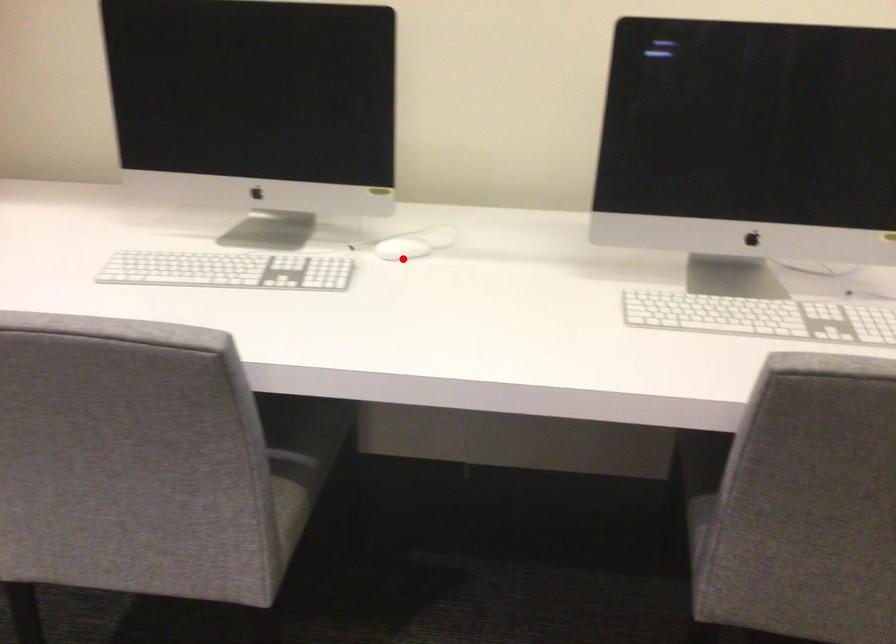
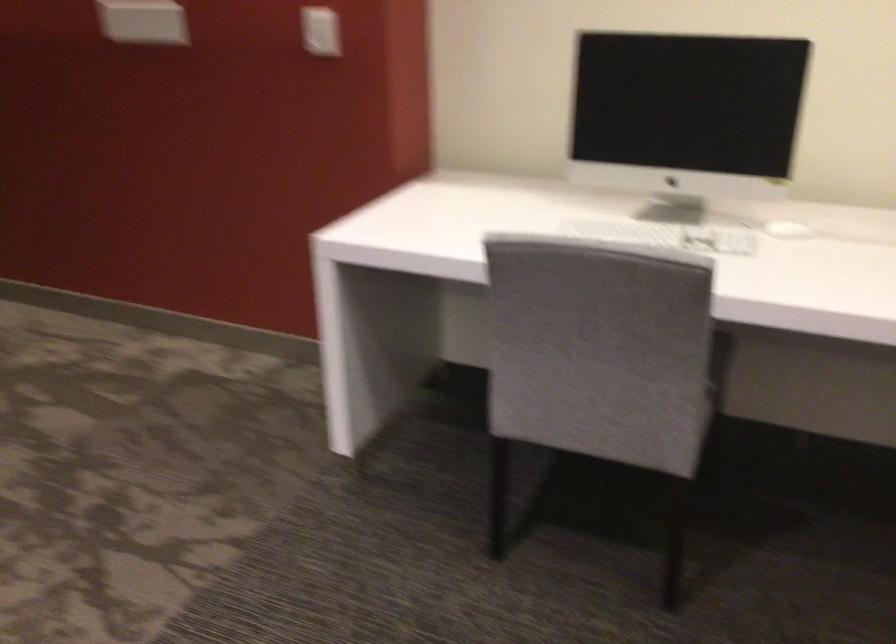
Question: I am providing you with two images of the same scene from different viewpoints. Image1 has a red point marked. In image2, the corresponding 3D location appears at what relative position? Reply with the corresponding letter.

Choices:
 (A) Closer
 (B) Farther

Answer: (B)